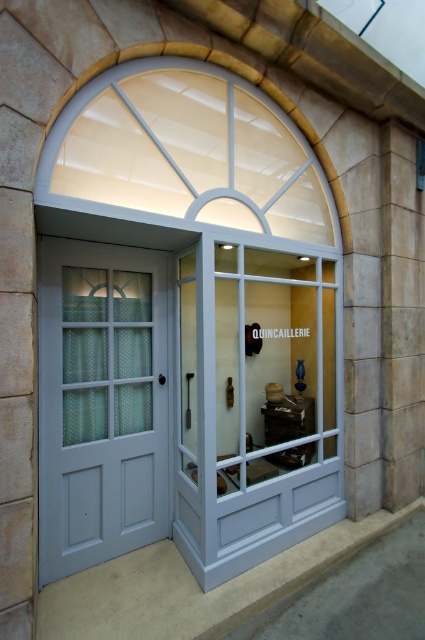
Question: Which object is the farthest from the white glass window at upper center?

Choices:
 (A) clear glass door at center
 (B) matte gray door at center

Answer: (B)

Question: Estimate the real-world distances between objects in this image. Which object is closer to the clear glass door at center?

Choices:
 (A) matte gray door at center
 (B) white glass window at upper center

Answer: (A)

Question: Does clear glass door at center have a larger size compared to white glass window at upper center?

Choices:
 (A) yes
 (B) no

Answer: (A)

Question: Can you confirm if clear glass door at center is positioned above matte gray door at center?

Choices:
 (A) yes
 (B) no

Answer: (A)

Question: Does matte gray door at center have a lesser width compared to white glass window at upper center?

Choices:
 (A) yes
 (B) no

Answer: (A)

Question: Which object is the closest to the matte gray door at center?

Choices:
 (A) clear glass door at center
 (B) white glass window at upper center

Answer: (A)